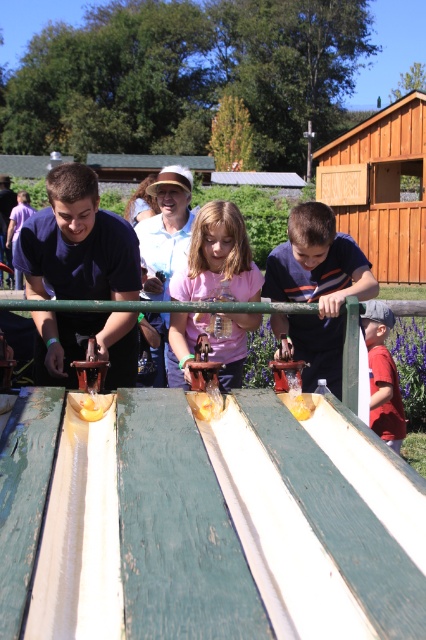
Question: Estimate the real-world distances between objects in this image. Which object is farther from the yellow matte bread at center?

Choices:
 (A) red cotton shirt at lower right
 (B) yellow rubber duck at center
 (C) yellow rubber boat at center
 (D) green wood rail at center

Answer: (D)

Question: Which object appears farthest from the camera in this image?

Choices:
 (A) green weathered wood ramp at center
 (B) pink matte shirt at center
 (C) red cotton shirt at lower right

Answer: (C)

Question: From the image, what is the correct spatial relationship of pink matte shirt at center in relation to yellow rubber boat at center?

Choices:
 (A) above
 (B) below

Answer: (A)

Question: Is the position of yellow rubber duck at center less distant than that of yellow rubber boat at center?

Choices:
 (A) no
 (B) yes

Answer: (B)

Question: Does pink matte shirt at center appear over green wood rail at center?

Choices:
 (A) no
 (B) yes

Answer: (A)

Question: Which point appears farthest from the camera in this image?

Choices:
 (A) (367, 305)
 (B) (210, 401)
 (C) (77, 412)
 (D) (294, 404)

Answer: (A)